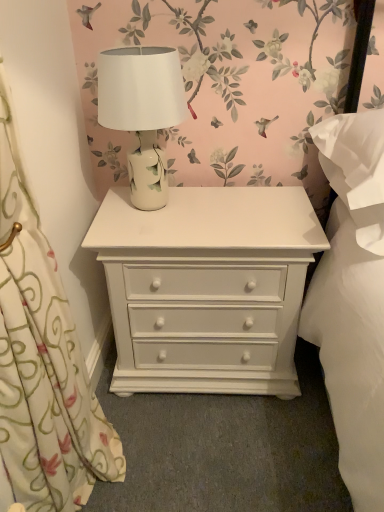
Where is `free space in front of white ceramic table lamp at center`? This screenshot has height=512, width=384. free space in front of white ceramic table lamp at center is located at coordinates (158, 233).